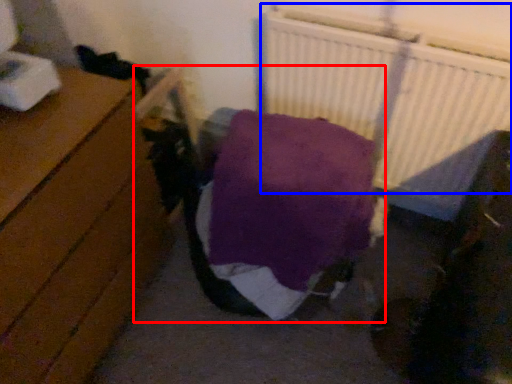
Question: Which object appears farthest to the camera in this image, bed (highlighted by a red box) or radiator (highlighted by a blue box)?

Choices:
 (A) bed
 (B) radiator

Answer: (B)